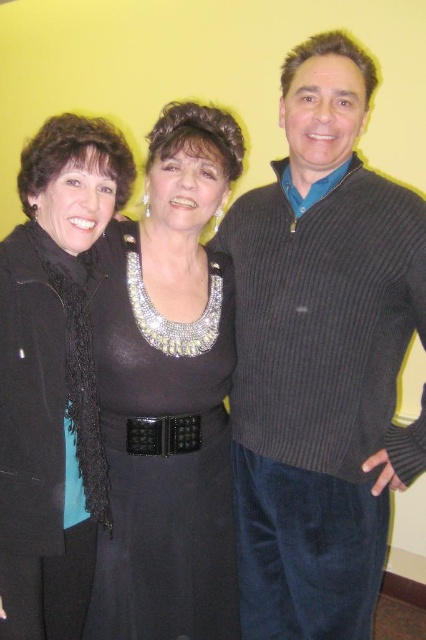
Question: Considering the real-world distances, which object is farthest from the black leather belt at center?

Choices:
 (A) black matte scarf at left
 (B) ribbed sweater at center

Answer: (B)

Question: Which object is closer to the camera taking this photo?

Choices:
 (A) ribbed sweater at center
 (B) black leather belt at center
 (C) black matte scarf at left

Answer: (C)

Question: Observing the image, what is the correct spatial positioning of ribbed sweater at center in reference to black satin dress at center?

Choices:
 (A) right
 (B) left

Answer: (A)

Question: Is black satin dress at center to the right of black matte scarf at left from the viewer's perspective?

Choices:
 (A) yes
 (B) no

Answer: (A)

Question: Does ribbed sweater at center lie in front of black satin dress at center?

Choices:
 (A) yes
 (B) no

Answer: (A)

Question: Which point is closer to the camera?

Choices:
 (A) black satin dress at center
 (B) black matte scarf at left
 (C) ribbed sweater at center
 (D) black leather belt at center

Answer: (B)